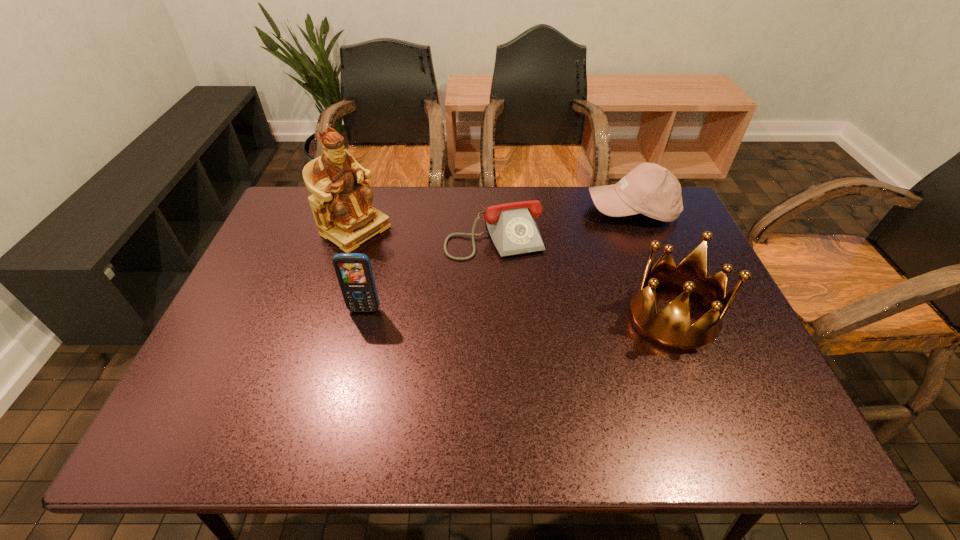
This screenshot has height=540, width=960. I want to click on object located in the left edge section of the desktop, so click(341, 203).

Locate an element on the screen. crown that is at the right edge is located at coordinates (670, 328).

This screenshot has height=540, width=960. I want to click on baseball cap that is positioned at the right edge, so click(x=649, y=189).

Locate an element on the screen. object located at the far left corner is located at coordinates (341, 203).

Locate an element on the screen. object that is at the far right corner is located at coordinates (649, 189).

The image size is (960, 540). Identify the location of vacant area at the far edge. (584, 211).

The height and width of the screenshot is (540, 960). I want to click on vacant space at the near edge of the desktop, so click(615, 368).

Where is `blank area at the left edge`? blank area at the left edge is located at coordinates (254, 302).

You are a GUI agent. You are given a task and a screenshot of the screen. Output one action in this format:
    pyautogui.click(x=<x>, y=<y>)
    Task: Click on the vacant region at the right edge of the desktop
    
    Given the screenshot: What is the action you would take?
    pyautogui.click(x=725, y=350)

You are a GUI agent. You are given a task and a screenshot of the screen. Output one action in this format:
    pyautogui.click(x=<x>, y=<y>)
    Task: Click on the vacant space at the far left corner of the desktop
    This screenshot has width=960, height=540.
    Given the screenshot: What is the action you would take?
    pyautogui.click(x=276, y=232)